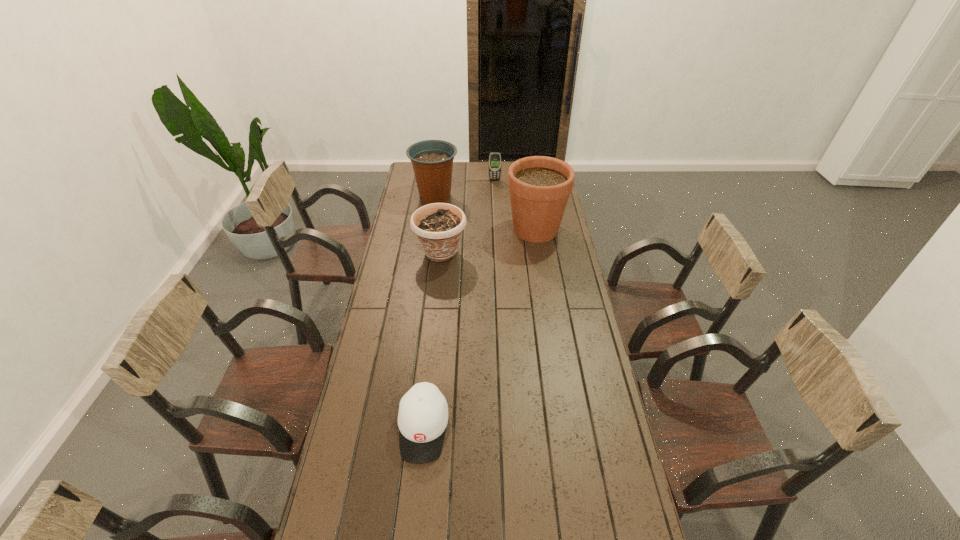
I want to click on free location located on the back of the second farthest object, so click(x=439, y=173).

At what (x,y) coordinates should I click in order to perform the action: click on vacant region located on the back of the shortest flowerpot. Please return your answer as a coordinate pair (x, y). The width and height of the screenshot is (960, 540). Looking at the image, I should click on (444, 220).

The image size is (960, 540). Identify the location of free spot located on the screen of the farthest object. (495, 189).

You are a GUI agent. You are given a task and a screenshot of the screen. Output one action in this format:
    pyautogui.click(x=<x>, y=<y>)
    Task: Click on the vacant space located on the front-facing side of the nearest object
    This screenshot has height=540, width=960.
    Given the screenshot: What is the action you would take?
    pyautogui.click(x=418, y=487)

Identify the location of object that is at the far edge. Image resolution: width=960 pixels, height=540 pixels. (495, 157).

The image size is (960, 540). I want to click on object that is at the right edge, so [539, 186].

The height and width of the screenshot is (540, 960). I want to click on vacant point at the left edge, so click(397, 370).

Where is `free space at the right edge of the desktop`? The image size is (960, 540). free space at the right edge of the desktop is located at coordinates (575, 324).

This screenshot has height=540, width=960. Find the location of `vacant space that's between the shortest object and the farthest flowerpot`. vacant space that's between the shortest object and the farthest flowerpot is located at coordinates (429, 312).

You are a GUI agent. You are given a task and a screenshot of the screen. Output one action in this format:
    pyautogui.click(x=<x>, y=<y>)
    Task: Click on the free space between the shortest object and the shortest flowerpot
    The width and height of the screenshot is (960, 540).
    Given the screenshot: What is the action you would take?
    pos(432,341)